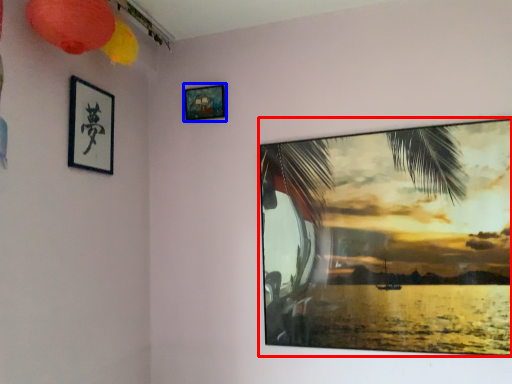
Question: Which object appears closest to the camera in this image, picture frame (highlighted by a red box) or picture frame (highlighted by a blue box)?

Choices:
 (A) picture frame
 (B) picture frame

Answer: (A)